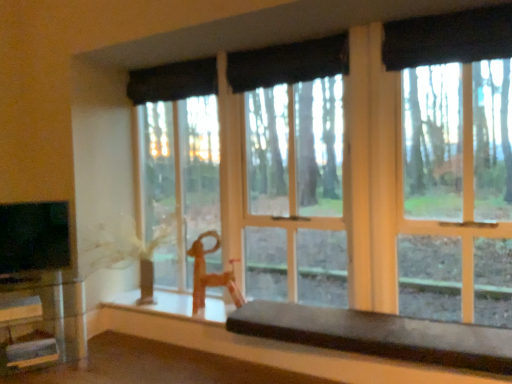
Question: Is smooth dark brown bench at lower center, the 1th table viewed from the right, taller than black fabric curtain at upper center, the 4th curtain from the front?

Choices:
 (A) yes
 (B) no

Answer: (B)

Question: From the image's perspective, would you say smooth dark brown bench at lower center, the 1th table viewed from the right, is positioned over black fabric curtain at upper center, the 4th curtain from the front?

Choices:
 (A) yes
 (B) no

Answer: (B)

Question: Can you confirm if smooth dark brown bench at lower center, arranged as the 2th table when viewed from the left, is bigger than black fabric curtain at upper center, placed as the first curtain when sorted from back to front?

Choices:
 (A) no
 (B) yes

Answer: (B)

Question: Can you confirm if smooth dark brown bench at lower center, arranged as the 2th table when viewed from the left, is wider than black fabric curtain at upper center, the 4th curtain from the front?

Choices:
 (A) yes
 (B) no

Answer: (A)

Question: From the image's perspective, is smooth dark brown bench at lower center, the 1th table viewed from the right, below black fabric curtain at upper center, placed as the first curtain when sorted from back to front?

Choices:
 (A) yes
 (B) no

Answer: (A)

Question: In terms of size, does black fabric curtain at upper center, placed as the first curtain when sorted from back to front, appear bigger or smaller than black glossy tv at left?

Choices:
 (A) small
 (B) big

Answer: (B)

Question: Considering their positions, is black fabric curtain at upper center, placed as the first curtain when sorted from back to front, located in front of or behind black glossy tv at left?

Choices:
 (A) behind
 (B) front

Answer: (A)

Question: Would you say black fabric curtain at upper center, placed as the first curtain when sorted from back to front, is to the left or to the right of black glossy tv at left in the picture?

Choices:
 (A) left
 (B) right

Answer: (B)

Question: Which is correct: black fabric curtain at upper center, placed as the first curtain when sorted from back to front, is inside black glossy tv at left, or outside of it?

Choices:
 (A) outside
 (B) inside

Answer: (A)

Question: Looking at their shapes, would you say black fabric curtain at upper center, which is the first curtain from front to back, is wider or thinner than black fabric curtain at upper center, the third curtain positioned from the front?

Choices:
 (A) thin
 (B) wide

Answer: (B)

Question: In the image, is black fabric curtain at upper center, which is the first curtain from front to back, on the left side or the right side of black fabric curtain at upper center, which is the second curtain in back-to-front order?

Choices:
 (A) left
 (B) right

Answer: (A)

Question: Choose the correct answer: Is black fabric curtain at upper center, which is the first curtain from front to back, inside black fabric curtain at upper center, the third curtain positioned from the front, or outside it?

Choices:
 (A) outside
 (B) inside

Answer: (A)

Question: Looking at the image, does black fabric curtain at upper center, which is the first curtain from front to back, seem bigger or smaller compared to black fabric curtain at upper center, the third curtain positioned from the front?

Choices:
 (A) small
 (B) big

Answer: (B)

Question: Considering the positions of point (343, 339) and point (245, 54), is point (343, 339) closer or farther from the camera than point (245, 54)?

Choices:
 (A) closer
 (B) farther

Answer: (A)

Question: Is smooth dark brown bench at lower center, arranged as the 2th table when viewed from the left, bigger or smaller than black fabric curtain at upper center, which is the second curtain in back-to-front order?

Choices:
 (A) big
 (B) small

Answer: (A)